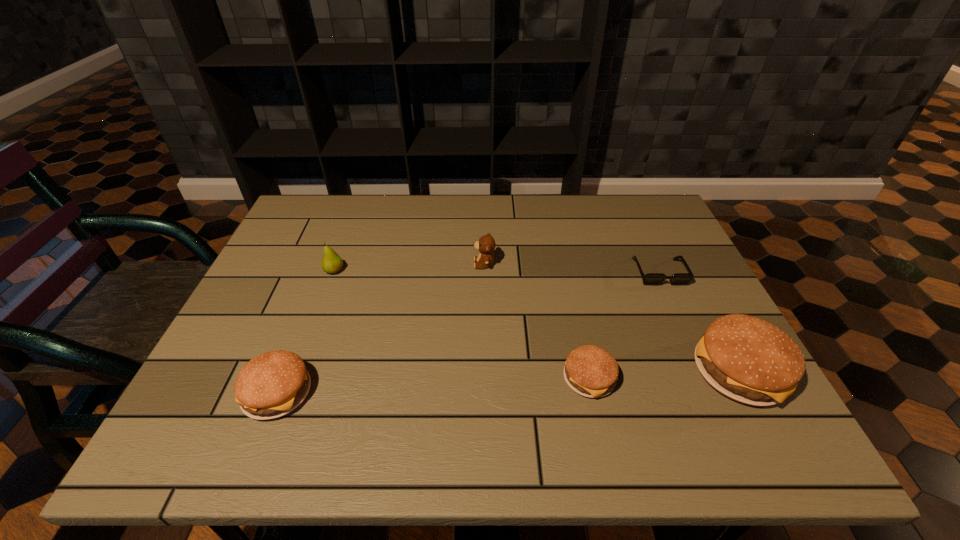
This screenshot has height=540, width=960. Find the location of `the third closest hamburger to the pear`. the third closest hamburger to the pear is located at coordinates (747, 359).

Identify the location of blank area in the image that satisfies the following two spatial constraints: 1. on the face of the fourth object from right to left; 2. on the right side of the tallest hamburger. (486, 372).

Locate an element on the screen. vacant region that satisfies the following two spatial constraints: 1. on the front side of the rightmost hamburger; 2. on the right side of the pear is located at coordinates (297, 372).

This screenshot has height=540, width=960. I want to click on vacant region that satisfies the following two spatial constraints: 1. on the front side of the pear; 2. on the right side of the rightmost hamburger, so click(297, 372).

The image size is (960, 540). What are the coordinates of `blank area in the image that satisfies the following two spatial constraints: 1. on the back side of the third object from right to left; 2. on the right side of the tallest hamburger` in the screenshot? It's located at (588, 372).

Find the location of a particular element. Image resolution: width=960 pixels, height=540 pixels. vacant point that satisfies the following two spatial constraints: 1. on the face of the rightmost hamburger; 2. on the left side of the teddy bear is located at coordinates pyautogui.click(x=486, y=372).

Locate an element on the screen. vacant region that satisfies the following two spatial constraints: 1. on the back side of the rightmost hamburger; 2. on the face of the fourth object from right to left is located at coordinates (683, 264).